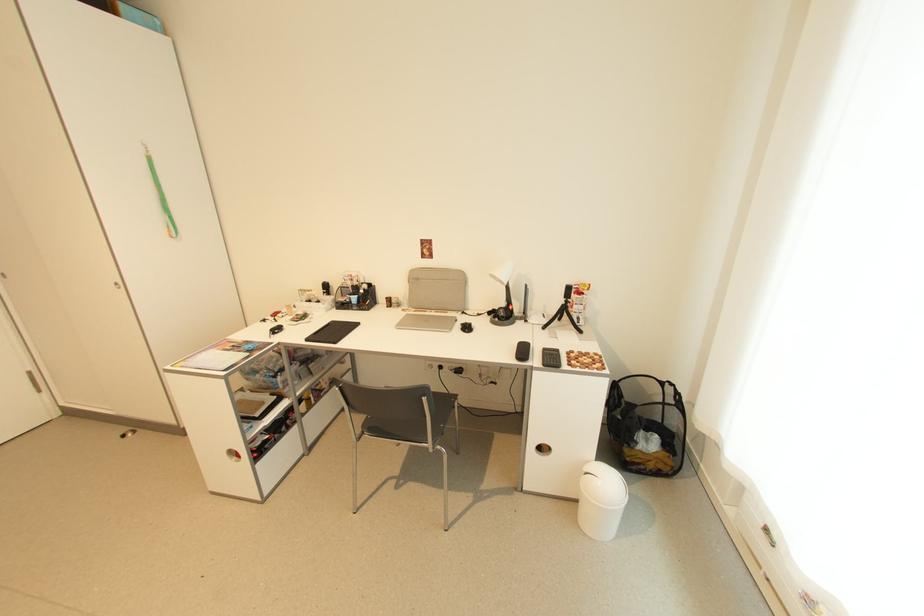
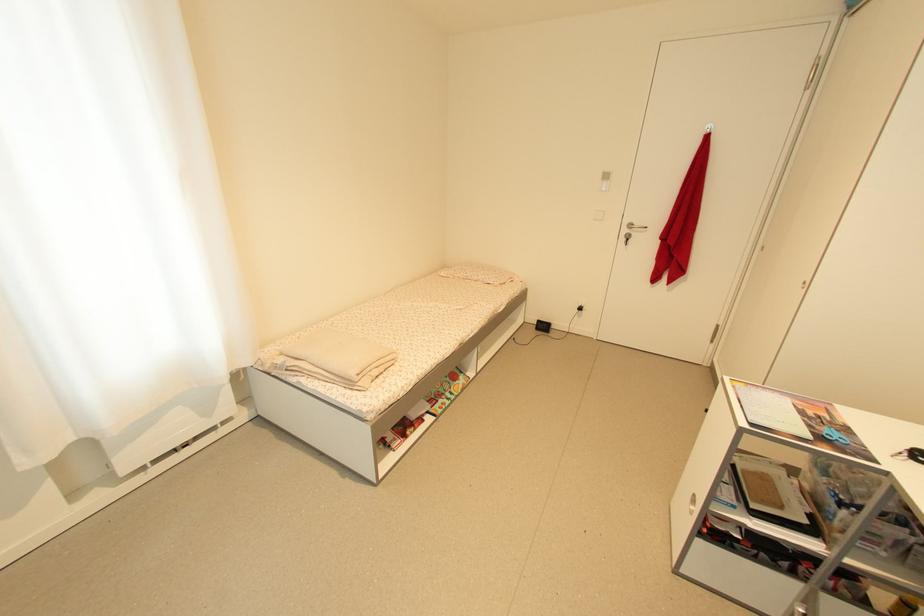
In the second image, find the point that corresponds to point 246,351 in the first image.

(822, 429)